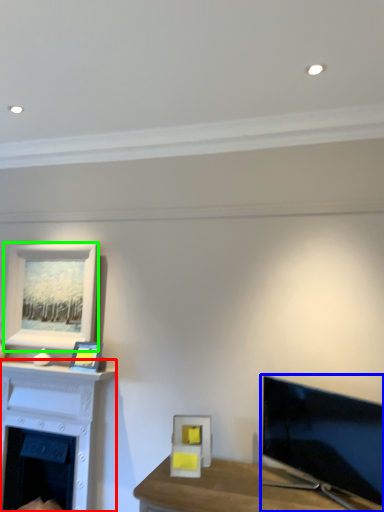
Question: Considering the real-world distances, which object is farthest from fireplace (highlighted by a red box)? television (highlighted by a blue box) or picture frame (highlighted by a green box)?

Choices:
 (A) television
 (B) picture frame

Answer: (A)